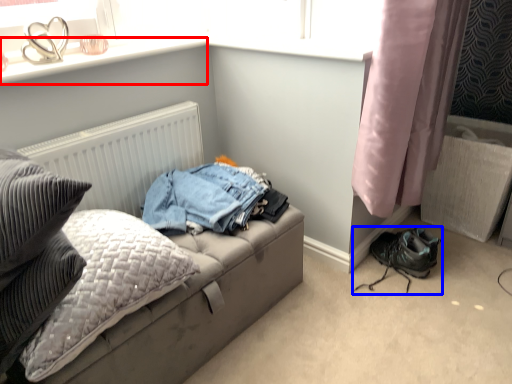
Question: Which of the following is the farthest to the observer, window sill (highlighted by a red box) or footwear (highlighted by a blue box)?

Choices:
 (A) window sill
 (B) footwear

Answer: (B)